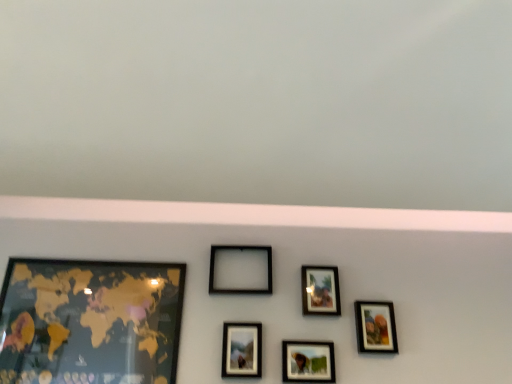
Question: Is matte glass photo frame at center, which is counted as the 3th picture frame, starting from the left, at the right side of matte black picture frame at center, which appears as the third picture frame when viewed from the right?

Choices:
 (A) no
 (B) yes

Answer: (A)

Question: Is the position of matte glass photo frame at center, which appears as the fourth picture frame when viewed from the right, less distant than that of matte black picture frame at center, which appears as the third picture frame when viewed from the right?

Choices:
 (A) no
 (B) yes

Answer: (B)

Question: From the image's perspective, is matte glass photo frame at center, which is counted as the 3th picture frame, starting from the left, on top of matte black picture frame at center, which appears as the third picture frame when viewed from the right?

Choices:
 (A) yes
 (B) no

Answer: (A)

Question: Can you confirm if matte glass photo frame at center, which is counted as the 3th picture frame, starting from the left, is wider than matte black picture frame at center, which appears as the third picture frame when viewed from the right?

Choices:
 (A) no
 (B) yes

Answer: (B)

Question: Is matte glass photo frame at center, which is counted as the 3th picture frame, starting from the left, positioned beyond the bounds of matte black picture frame at center, which appears as the third picture frame when viewed from the right?

Choices:
 (A) no
 (B) yes

Answer: (B)

Question: In the image, is matte black picture frame at center, which appears as the third picture frame when viewed from the right, positioned in front of or behind matte black picture frame at upper center, the 2th picture frame from the right?

Choices:
 (A) front
 (B) behind

Answer: (A)

Question: Is matte black picture frame at center, placed as the fourth picture frame when sorted from left to right, bigger or smaller than matte black picture frame at upper center, the 2th picture frame from the right?

Choices:
 (A) big
 (B) small

Answer: (A)

Question: Based on their positions, is matte black picture frame at center, which appears as the third picture frame when viewed from the right, located to the left or right of matte black picture frame at upper center, the fifth picture frame viewed from the left?

Choices:
 (A) right
 (B) left

Answer: (B)

Question: From the image's perspective, relative to matte black picture frame at upper center, the 2th picture frame from the right, is matte black picture frame at center, placed as the fourth picture frame when sorted from left to right, above or below?

Choices:
 (A) above
 (B) below

Answer: (B)

Question: Is matte black picture frame at center, which appears as the third picture frame when viewed from the right, taller or shorter than matte glass photo frame at center, which is counted as the 3th picture frame, starting from the left?

Choices:
 (A) tall
 (B) short

Answer: (B)

Question: In terms of size, does matte black picture frame at center, placed as the fourth picture frame when sorted from left to right, appear bigger or smaller than matte glass photo frame at center, which appears as the fourth picture frame when viewed from the right?

Choices:
 (A) big
 (B) small

Answer: (B)

Question: From a real-world perspective, is matte black picture frame at center, placed as the fourth picture frame when sorted from left to right, physically located above or below matte glass photo frame at center, which appears as the fourth picture frame when viewed from the right?

Choices:
 (A) above
 (B) below

Answer: (B)

Question: Is matte black picture frame at center, placed as the fourth picture frame when sorted from left to right, inside the boundaries of matte glass photo frame at center, which is counted as the 3th picture frame, starting from the left, or outside?

Choices:
 (A) outside
 (B) inside

Answer: (A)

Question: Is matte black picture frame at upper center, the fifth picture frame viewed from the left, inside or outside of matte glass photo frame at center, which is counted as the 3th picture frame, starting from the left?

Choices:
 (A) inside
 (B) outside

Answer: (B)

Question: Is matte black picture frame at upper center, the 2th picture frame from the right, in front of or behind matte glass photo frame at center, which is counted as the 3th picture frame, starting from the left, in the image?

Choices:
 (A) front
 (B) behind

Answer: (B)